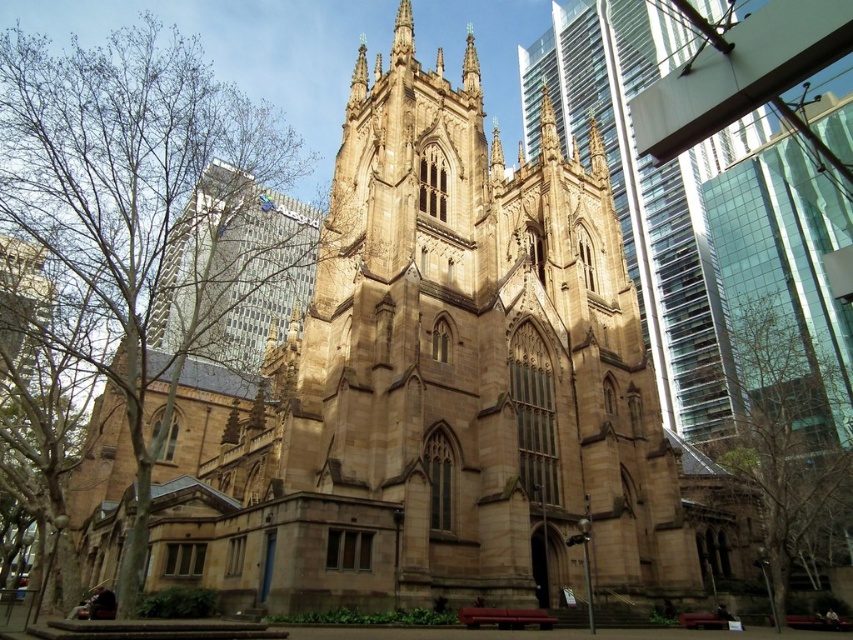
You are a visitor standing at the entrance of the cathedral. You notice two trees in the scene. Which tree, the brown leafless tree at left or the brown textured tree at lower right, is positioned higher up in the image?

The brown leafless tree at left is located above the brown textured tree at lower right in the image.

You are standing in front of the cathedral and want to take a photo that includes both the brown leafless tree at left and the brown textured tree at lower right. Which tree should you position closer to the left side of your camera frame?

You should position the brown leafless tree at left closer to the left side of your camera frame because it is already to the left of the brown textured tree at lower right.

You are a tourist standing in front of the cathedral and want to take a photo that includes both the brown leafless tree at left and the brown textured tree at lower right. Which tree should you position closer to the camera to ensure both are in the frame?

You should position the brown leafless tree at left closer to the camera since it is already closer to the viewer than the brown textured tree at lower right, ensuring both are within the frame.